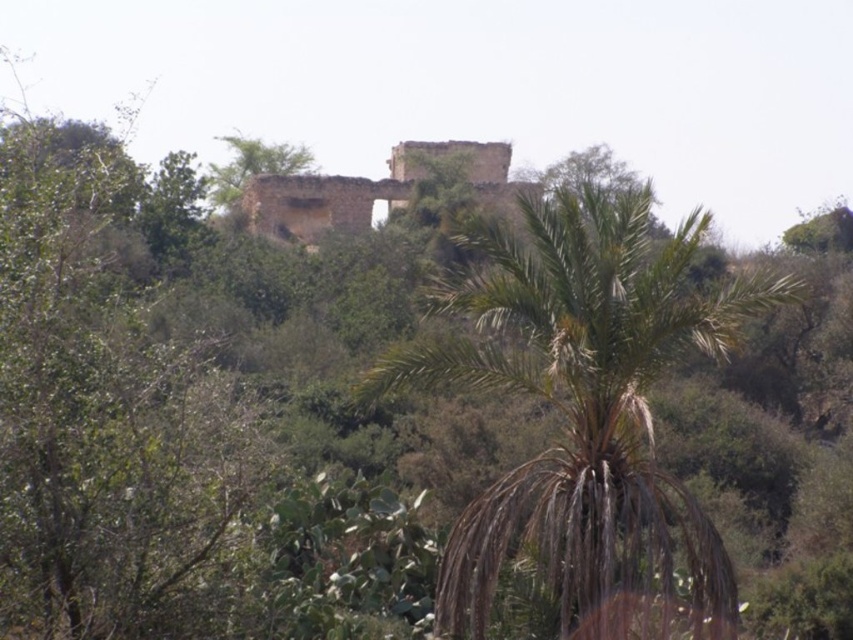
Question: Which point is closer to the camera?

Choices:
 (A) brown textured palm tree at center
 (B) weathered stone castle at center

Answer: (A)

Question: Does brown textured palm tree at center lie in front of weathered stone castle at center?

Choices:
 (A) yes
 (B) no

Answer: (A)

Question: Which point is closer to the camera taking this photo?

Choices:
 (A) (625, 273)
 (B) (415, 145)

Answer: (A)

Question: Is brown textured palm tree at center wider than weathered stone castle at center?

Choices:
 (A) no
 (B) yes

Answer: (A)

Question: Does brown textured palm tree at center appear on the right side of weathered stone castle at center?

Choices:
 (A) no
 (B) yes

Answer: (B)